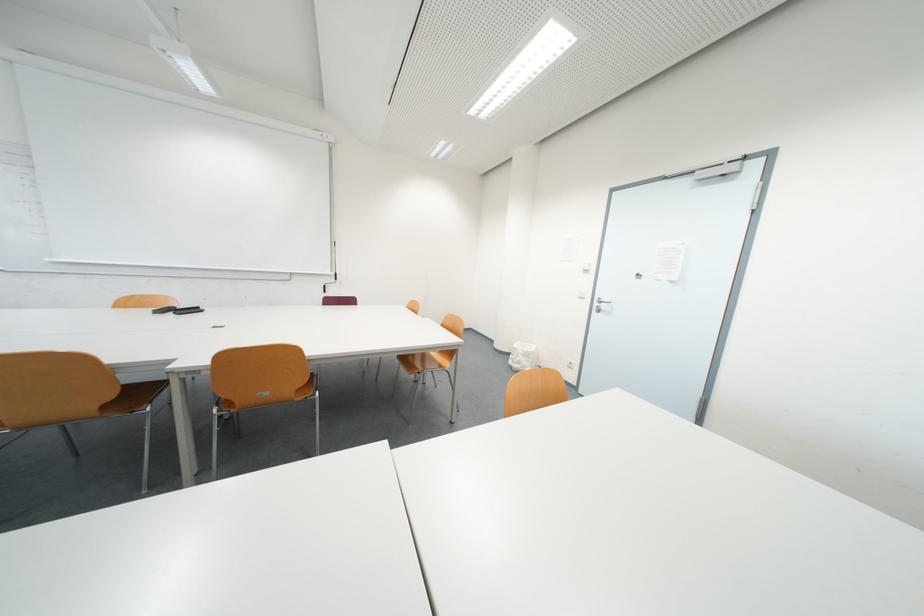
Where is `white light switch`? The height and width of the screenshot is (616, 924). white light switch is located at coordinates (569, 363).